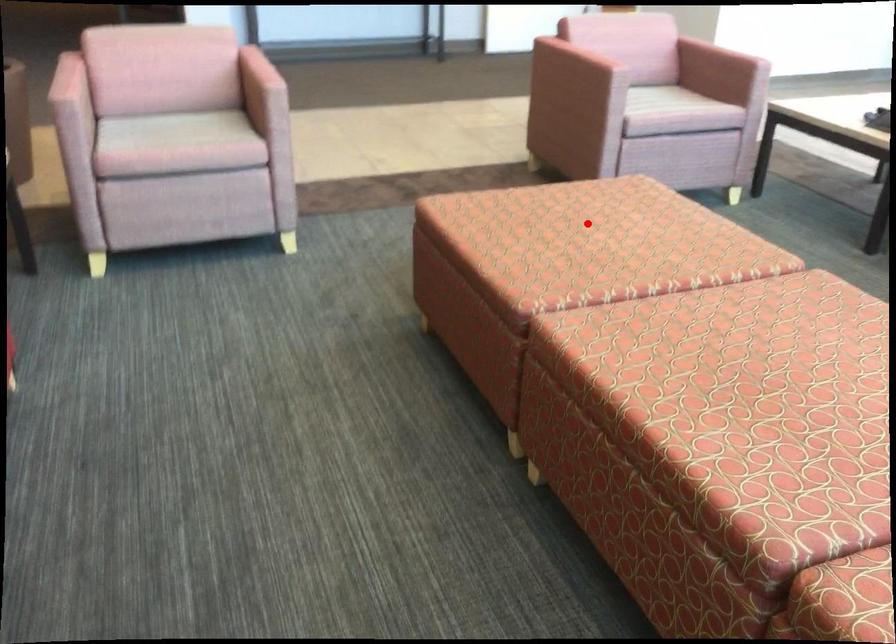
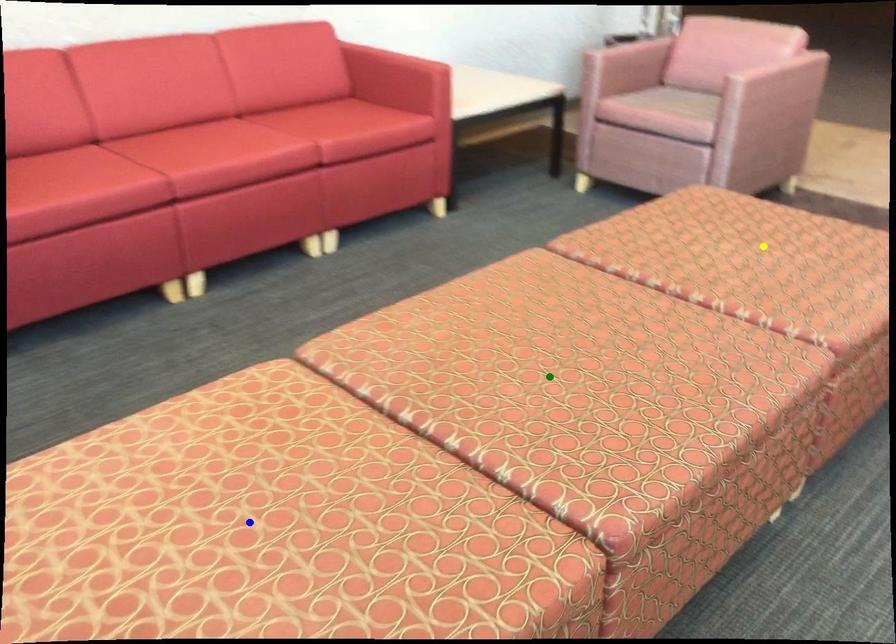
Question: I am providing you with two images of the same scene from different viewpoints. A red point is marked on the first image. You are given multiple points on the second image. Which point in image 2 represents the same 3d spot as the red point in image 1?

Choices:
 (A) green point
 (B) yellow point
 (C) blue point

Answer: (B)